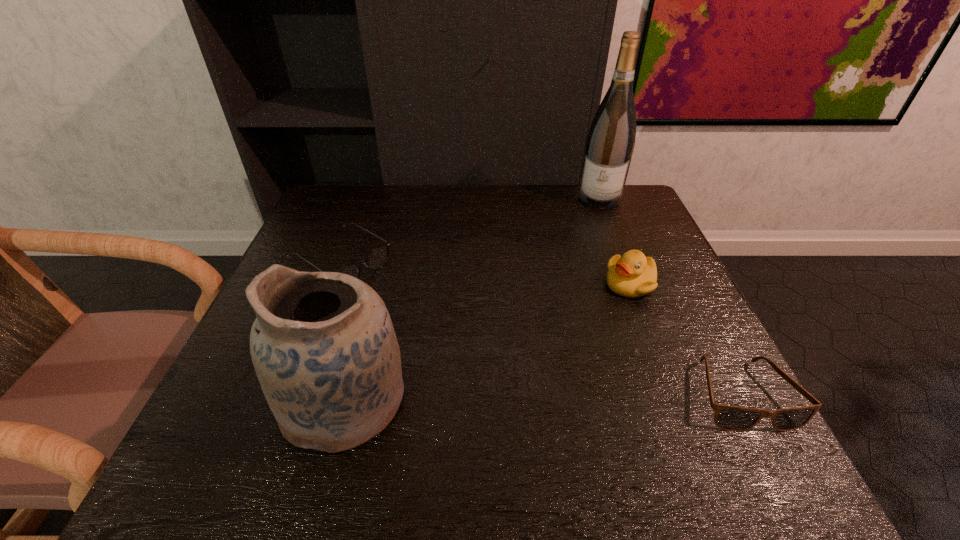
This screenshot has height=540, width=960. I want to click on pottery, so click(x=323, y=346).

At what (x,y) coordinates should I click in order to perform the action: click on sunglasses. Please return your answer as a coordinate pair (x, y). The width and height of the screenshot is (960, 540). Looking at the image, I should click on (730, 418).

The width and height of the screenshot is (960, 540). I want to click on the third tallest object, so click(632, 275).

Locate an element on the screen. The height and width of the screenshot is (540, 960). the farthest object is located at coordinates (610, 143).

Image resolution: width=960 pixels, height=540 pixels. In order to click on the tallest object in this screenshot , I will do `click(610, 143)`.

The width and height of the screenshot is (960, 540). I want to click on spectacles, so click(376, 259).

I want to click on vacant space situated 0.340m on the right of the pottery, so click(x=597, y=400).

This screenshot has width=960, height=540. What are the coordinates of `free point located at the face of the third tallest object` in the screenshot? It's located at (560, 362).

Find the location of a particular element. free space located 0.130m at the face of the third tallest object is located at coordinates point(589,330).

The image size is (960, 540). What are the coordinates of `blank space located 0.310m at the face of the third tallest object` in the screenshot? It's located at (540, 386).